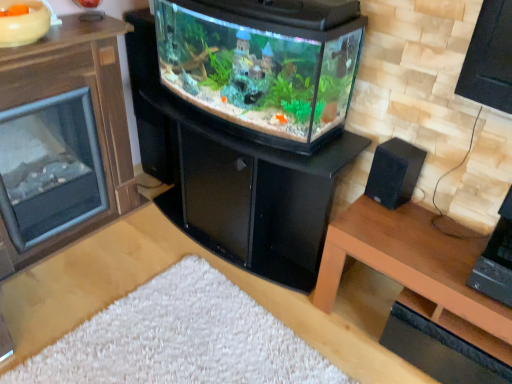
Locate an element on the screen. brown wood table at lower right is located at coordinates (416, 270).

This screenshot has height=384, width=512. Find the location of `black glossy fireplace at center`. black glossy fireplace at center is located at coordinates (248, 131).

Describe the element at coordinates (394, 173) in the screenshot. I see `black matte speaker at right` at that location.

The width and height of the screenshot is (512, 384). Find the location of `brown wood table at lower right`. brown wood table at lower right is located at coordinates pyautogui.click(x=416, y=270).

Is brown wood fireplace at left looking in the opposite direction of black matte speaker at right?

No, brown wood fireplace at left is not facing away from black matte speaker at right.

Is brown wood fireplace at left closer to camera compared to black matte speaker at right?

Yes.

In the image, there is a black matte speaker at right. At what (x,y) coordinates should I click in order to perform the action: click on furniture above it (from the image's perspective). Please return your answer as a coordinate pair (x, y). The height and width of the screenshot is (384, 512). Looking at the image, I should click on (92, 110).

From their relative heights in the image, would you say brown wood fireplace at left is taller or shorter than black matte speaker at right?

In the image, brown wood fireplace at left appears to be taller than black matte speaker at right.

From the image's perspective, which is above, brown wood table at lower right or black glossy fireplace at center?

black glossy fireplace at center appears higher in the image.

Is brown wood table at lower right shorter than black glossy fireplace at center?

Yes.

Is brown wood table at lower right situated inside black glossy fireplace at center or outside?

brown wood table at lower right is not inside black glossy fireplace at center, it's outside.

Is brown wood table at lower right smaller than black glossy fireplace at center?

Yes.

From a real-world perspective, is brown wood table at lower right located beneath brown wood fireplace at left?

Yes, from a real-world perspective, brown wood table at lower right is below brown wood fireplace at left.

Is brown wood table at lower right positioned in front of brown wood fireplace at left?

Yes, brown wood table at lower right is closer to the camera.

Consider the image. Is brown wood table at lower right positioned with its back to brown wood fireplace at left?

That's not correct — brown wood table at lower right is not looking away from brown wood fireplace at left.

Looking at this image, which object is positioned more to the left, brown wood table at lower right or brown wood fireplace at left?

brown wood fireplace at left.

Is black glossy fireplace at center positioned with its back to brown wood fireplace at left?

No, black glossy fireplace at center is not facing away from brown wood fireplace at left.

Considering their positions, is black glossy fireplace at center located in front of or behind brown wood fireplace at left?

black glossy fireplace at center is behind brown wood fireplace at left.

From their relative heights in the image, would you say black glossy fireplace at center is taller or shorter than brown wood fireplace at left?

black glossy fireplace at center is shorter than brown wood fireplace at left.

Image resolution: width=512 pixels, height=384 pixels. Identify the location of table located below the black glossy fireplace at center (from the image's perspective). (416, 270).

Is black glossy fireplace at center inside the boundaries of brown wood table at lower right, or outside?

black glossy fireplace at center is outside brown wood table at lower right.

From a real-world perspective, is black glossy fireplace at center positioned under brown wood table at lower right based on gravity?

No, from a real-world perspective, black glossy fireplace at center is not below brown wood table at lower right.

Is black glossy fireplace at center taller or shorter than brown wood table at lower right?

In the image, black glossy fireplace at center appears to be taller than brown wood table at lower right.

Between black matte speaker at right and brown wood table at lower right, which one has more height?

Standing taller between the two is brown wood table at lower right.

Is black matte speaker at right positioned beyond the bounds of brown wood table at lower right?

That's correct, black matte speaker at right is outside of brown wood table at lower right.

Between black matte speaker at right and brown wood table at lower right, which one appears on the right side from the viewer's perspective?

brown wood table at lower right is more to the right.

Is black matte speaker at right looking in the opposite direction of brown wood table at lower right?

black matte speaker at right does not have its back to brown wood table at lower right.

Considering the relative sizes of black glossy fireplace at center and black matte speaker at right in the image provided, is black glossy fireplace at center thinner than black matte speaker at right?

Incorrect, the width of black glossy fireplace at center is not less than that of black matte speaker at right.

Does black glossy fireplace at center turn towards black matte speaker at right?

No, black glossy fireplace at center is not aimed at black matte speaker at right.

In the scene shown: How many degrees apart are the facing directions of black glossy fireplace at center and black matte speaker at right?

The angular difference between black glossy fireplace at center and black matte speaker at right is 10.4 degrees.

Considering the positions of point (307, 58) and point (404, 144), is point (307, 58) closer or farther from the camera than point (404, 144)?

Point (307, 58) is farther from the camera than point (404, 144).

Locate an element on the screen. This screenshot has width=512, height=384. furniture directly beneath the black matte speaker at right (from a real-world perspective) is located at coordinates (92, 110).

I want to click on table lying below the black glossy fireplace at center (from the image's perspective), so pyautogui.click(x=416, y=270).

Based on the photo, from the image, which object appears to be nearer to black matte speaker at right, black glossy fireplace at center or brown wood table at lower right?

brown wood table at lower right lies closer to black matte speaker at right than the other object.

Looking at the image, which one is located further to brown wood table at lower right, brown wood fireplace at left or black matte speaker at right?

The object further to brown wood table at lower right is brown wood fireplace at left.

From the image, which object appears to be nearer to black glossy fireplace at center, brown wood table at lower right or brown wood fireplace at left?

Based on the image, brown wood table at lower right appears to be nearer to black glossy fireplace at center.

Looking at the image, which one is located closer to brown wood table at lower right, black glossy fireplace at center or brown wood fireplace at left?

black glossy fireplace at center.

Which object lies nearer to the anchor point brown wood fireplace at left, black matte speaker at right or black glossy fireplace at center?

Among the two, black glossy fireplace at center is located nearer to brown wood fireplace at left.

From the image, which object appears to be farther from brown wood table at lower right, brown wood fireplace at left or black glossy fireplace at center?

brown wood fireplace at left lies further to brown wood table at lower right than the other object.

Considering their positions, is black matte speaker at right positioned closer to brown wood table at lower right than black glossy fireplace at center?

Among the two, black matte speaker at right is located nearer to brown wood table at lower right.

Which object lies nearer to the anchor point black matte speaker at right, brown wood fireplace at left or black glossy fireplace at center?

black glossy fireplace at center lies closer to black matte speaker at right than the other object.

Find the location of a particular element. fireplace located between brown wood fireplace at left and black matte speaker at right in the left-right direction is located at coordinates (248, 131).

Image resolution: width=512 pixels, height=384 pixels. I want to click on fireplace between brown wood fireplace at left and brown wood table at lower right in the horizontal direction, so click(248, 131).

The height and width of the screenshot is (384, 512). I want to click on speaker between black glossy fireplace at center and brown wood table at lower right in the horizontal direction, so click(x=394, y=173).

Identify the location of speaker between brown wood fireplace at left and brown wood table at lower right. The width and height of the screenshot is (512, 384). click(x=394, y=173).